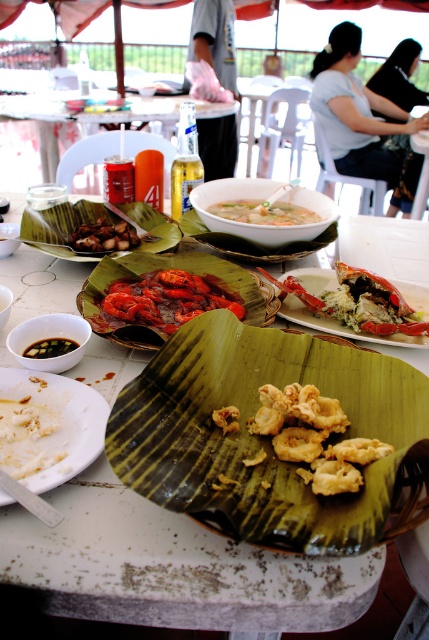
You are a food critic evaluating the arrangement of dishes on the table. Which dish, the red glossy crayfish at center or the white creamy food at lower left, is placed higher up on the table?

The red glossy crayfish at center is positioned over the white creamy food at lower left, so it is placed higher up on the table.

You are a server who needs to place a new dish on the table. The dish is 12 inches in diameter. Can you fit it between the green leaf plate at center and the white ceramic bowl at center without moving them?

The distance between the green leaf plate at center and the white ceramic bowl at center is 10.56 inches. Since the dish is 12 inches in diameter, which is larger than the available space, it cannot be placed between them without moving the existing items.